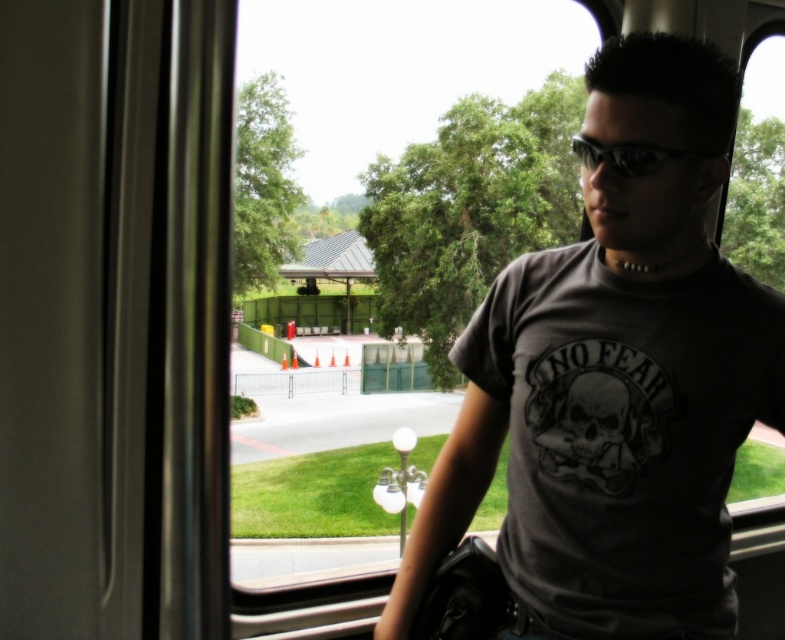
Question: Among these objects, which one is nearest to the camera?

Choices:
 (A) sunglasses at center
 (B) gray matte t-shirt at center

Answer: (B)

Question: Which of the following is the farthest from the observer?

Choices:
 (A) gray matte t-shirt at center
 (B) sunglasses at center

Answer: (B)

Question: Does gray matte t-shirt at center come behind sunglasses at center?

Choices:
 (A) yes
 (B) no

Answer: (B)

Question: Is gray matte t-shirt at center to the right of sunglasses at center from the viewer's perspective?

Choices:
 (A) no
 (B) yes

Answer: (A)

Question: Is gray matte t-shirt at center above sunglasses at center?

Choices:
 (A) no
 (B) yes

Answer: (A)